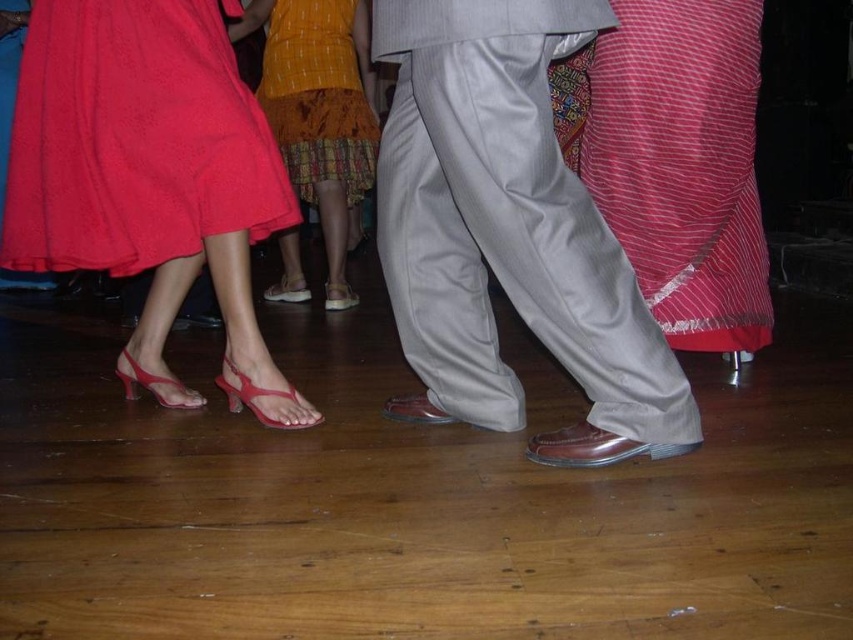
You are organizing a fashion show and need to arrange the matte red skirt at lower left and the yellow printed fabric at center based on their sizes. Which one should you place first if you want to start with the larger item?

The matte red skirt at lower left should be placed first because its width is larger than the yellow printed fabric at center.

You are a dance instructor observing the dance floor. You notice the matte leather shoes at center and the red striped fabric at right. Which object is wider in terms of their width?

The matte leather shoes at center might be wider than red striped fabric at right according to the description.

You are at a dance party and want to know which object is smaller between the matte red skirt at lower left and the yellow printed fabric at center. Can you tell me?

The matte red skirt at lower left has a smaller size compared to the yellow printed fabric at center, so the matte red skirt at lower left is smaller.